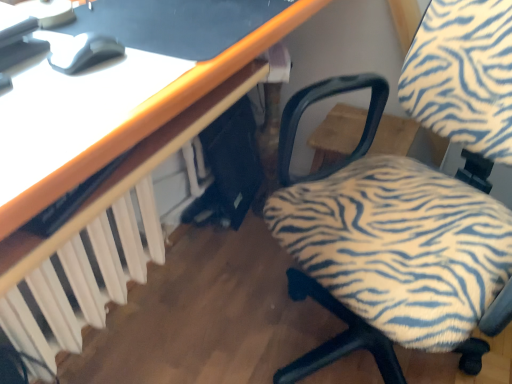
Question: Is the position of zebra-patterned fabric chair at center-right less distant than that of matte gray mouse at upper left?

Choices:
 (A) yes
 (B) no

Answer: (A)

Question: Does zebra-patterned fabric chair at center-right have a greater height compared to matte gray mouse at upper left?

Choices:
 (A) no
 (B) yes

Answer: (B)

Question: Can you confirm if zebra-patterned fabric chair at center-right is thinner than matte gray mouse at upper left?

Choices:
 (A) no
 (B) yes

Answer: (A)

Question: Is zebra-patterned fabric chair at center-right bigger than matte gray mouse at upper left?

Choices:
 (A) yes
 (B) no

Answer: (A)

Question: Does zebra-patterned fabric chair at center-right have a greater width compared to matte gray mouse at upper left?

Choices:
 (A) yes
 (B) no

Answer: (A)

Question: Can you confirm if zebra-patterned fabric chair at center-right is smaller than matte gray mouse at upper left?

Choices:
 (A) yes
 (B) no

Answer: (B)

Question: Does matte gray mouse at upper left come behind zebra-patterned fabric chair at center-right?

Choices:
 (A) yes
 (B) no

Answer: (A)

Question: Can you confirm if matte gray mouse at upper left is taller than zebra-patterned fabric chair at center-right?

Choices:
 (A) no
 (B) yes

Answer: (A)

Question: Is matte gray mouse at upper left touching zebra-patterned fabric chair at center-right?

Choices:
 (A) yes
 (B) no

Answer: (B)

Question: Can you confirm if matte gray mouse at upper left is bigger than zebra-patterned fabric chair at center-right?

Choices:
 (A) yes
 (B) no

Answer: (B)

Question: Is zebra-patterned fabric chair at center-right at the back of matte gray mouse at upper left?

Choices:
 (A) yes
 (B) no

Answer: (B)

Question: From a real-world perspective, is matte gray mouse at upper left positioned under zebra-patterned fabric chair at center-right based on gravity?

Choices:
 (A) no
 (B) yes

Answer: (A)

Question: Is white plastic radiator at lower left inside matte gray mouse at upper left?

Choices:
 (A) yes
 (B) no

Answer: (B)